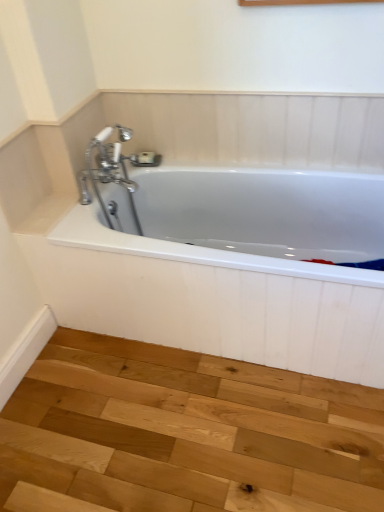
Question: From a real-world perspective, is white glossy bathtub at center positioned above or below natural wood stair at lower left?

Choices:
 (A) above
 (B) below

Answer: (A)

Question: From the image's perspective, is white glossy bathtub at center above or below natural wood stair at lower left?

Choices:
 (A) below
 (B) above

Answer: (B)

Question: Considering the positions of white glossy bathtub at center and natural wood stair at lower left in the image, is white glossy bathtub at center wider or thinner than natural wood stair at lower left?

Choices:
 (A) thin
 (B) wide

Answer: (A)

Question: From their relative heights in the image, would you say natural wood stair at lower left is taller or shorter than white glossy bathtub at center?

Choices:
 (A) tall
 (B) short

Answer: (B)

Question: Would you say natural wood stair at lower left is inside or outside white glossy bathtub at center?

Choices:
 (A) outside
 (B) inside

Answer: (A)

Question: In terms of width, does natural wood stair at lower left look wider or thinner when compared to white glossy bathtub at center?

Choices:
 (A) thin
 (B) wide

Answer: (B)

Question: Considering their positions, is natural wood stair at lower left located in front of or behind white glossy bathtub at center?

Choices:
 (A) behind
 (B) front

Answer: (B)